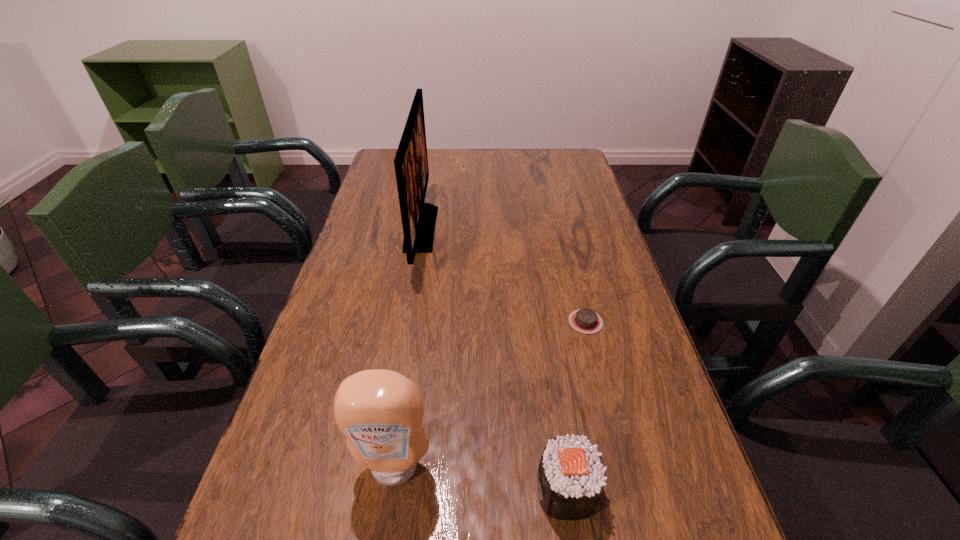
Where is `free space between the third tallest object and the tallest object`? free space between the third tallest object and the tallest object is located at coordinates (494, 360).

Identify the location of free space between the third nearest object and the monitor. The height and width of the screenshot is (540, 960). 503,275.

The height and width of the screenshot is (540, 960). Find the location of `free point between the second shortest object and the shortest object`. free point between the second shortest object and the shortest object is located at coordinates (576, 406).

At what (x,y) coordinates should I click in order to perform the action: click on vacant space that's between the second shortest object and the second tallest object. Please return your answer as a coordinate pair (x, y). This screenshot has height=540, width=960. Looking at the image, I should click on (481, 479).

Where is `free space between the third shortest object and the chocolate cake`? Image resolution: width=960 pixels, height=540 pixels. free space between the third shortest object and the chocolate cake is located at coordinates (490, 395).

Where is `vacant space that's between the monitor and the rightmost object`? vacant space that's between the monitor and the rightmost object is located at coordinates (503, 275).

In order to click on free space between the shortest object and the second object from right to left in this screenshot , I will do `click(576, 406)`.

Identify which object is the third closest to the second farthest object. Please provide its 2D coordinates. Your answer should be formatted as a tuple, i.e. [(x, y)], where the tuple contains the x and y coordinates of a point satisfying the conditions above.

[(380, 412)]

Identify which object is the third closest to the monitor. Please provide its 2D coordinates. Your answer should be formatted as a tuple, i.e. [(x, y)], where the tuple contains the x and y coordinates of a point satisfying the conditions above.

[(570, 479)]

This screenshot has width=960, height=540. I want to click on vacant space that satisfies the following two spatial constraints: 1. on the label of the second object from right to left; 2. on the right side of the second tallest object, so click(391, 490).